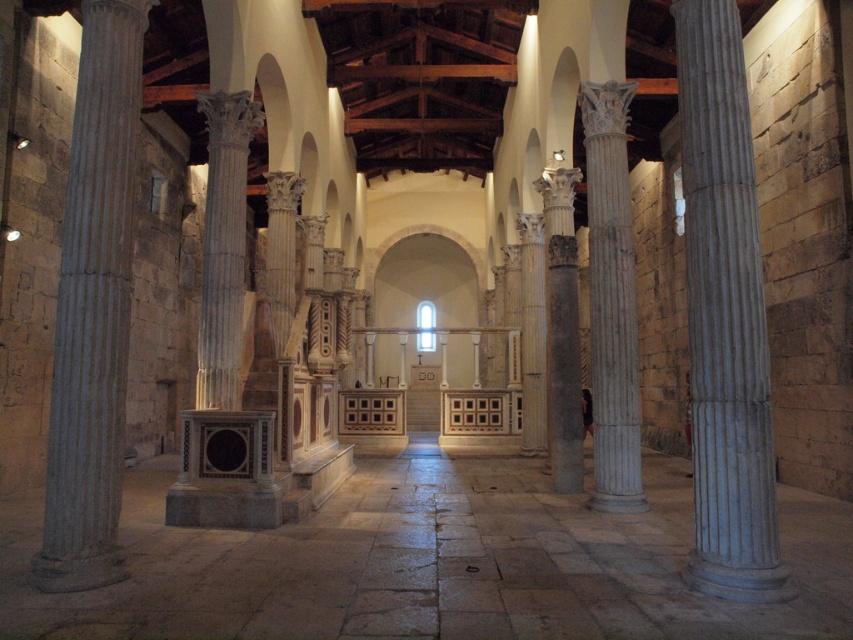
You are standing in the nave of the cathedral and want to place a large statue on the floor directly under the gray marble column at center. Is the white marble floor at center suitable for this placement?

Yes, the white marble floor at center is located below the gray marble column at center, making it the ideal spot to place the statue directly underneath the column.

You are standing at the entrance of the historical building and want to walk directly towards the altar area. Which direction should you head from your current position to reach the white marble floor at center?

Since the white marble floor at center is located at point 0.883 on the x axis and 0.506 on the y axis, you should head towards the direction of the altar area which is at the far end of the nave. The coordinates suggest that moving forward along the central axis of the nave will lead you directly to the white marble floor at center.